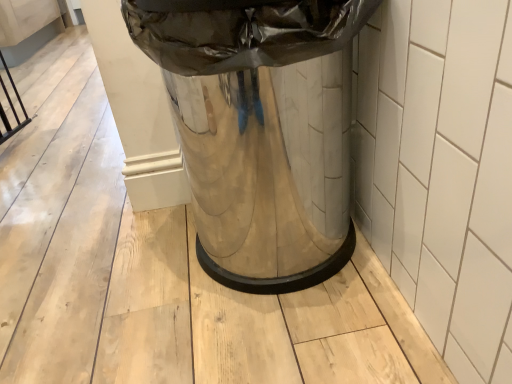
Question: Looking at the image, does white glossy tile at right seem bigger or smaller compared to polished metallic trash can at center?

Choices:
 (A) small
 (B) big

Answer: (A)

Question: Would you say white glossy tile at right is to the left or to the right of polished metallic trash can at center in the picture?

Choices:
 (A) right
 (B) left

Answer: (A)

Question: Is white glossy tile at right taller or shorter than polished metallic trash can at center?

Choices:
 (A) short
 (B) tall

Answer: (A)

Question: From a real-world perspective, is polished metallic trash can at center physically located above or below white glossy tile at right?

Choices:
 (A) below
 (B) above

Answer: (B)

Question: From the image's perspective, is polished metallic trash can at center located above or below white glossy tile at right?

Choices:
 (A) below
 (B) above

Answer: (B)

Question: From their relative heights in the image, would you say polished metallic trash can at center is taller or shorter than white glossy tile at right?

Choices:
 (A) tall
 (B) short

Answer: (A)

Question: Is point (318, 92) closer or farther from the camera than point (450, 104)?

Choices:
 (A) farther
 (B) closer

Answer: (A)